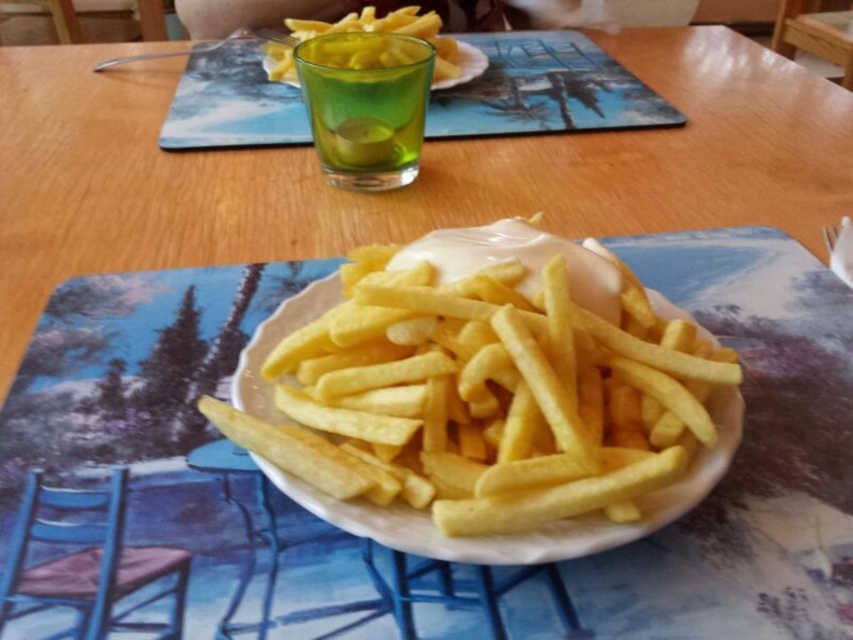
Can you confirm if golden crispy french fries at center is positioned above yellow crispy french fries at upper center?

No.

Between point (695, 365) and point (264, 58), which one is positioned behind?

Positioned behind is point (264, 58).

Find the location of a particular element. golden crispy french fries at center is located at coordinates (482, 401).